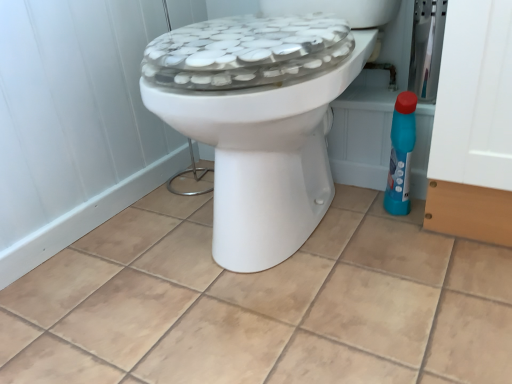
Locate an element on the screen. This screenshot has height=384, width=512. beige ceramic tile at center is located at coordinates (262, 304).

Locate an element on the screen. blue plastic bottle at right is located at coordinates (401, 154).

Locate an element on the screen. The image size is (512, 384). toilet that appears above the blue plastic bottle at right (from a real-world perspective) is located at coordinates (258, 121).

Consider the image. Is white glossy toilet at center looking in the opposite direction of blue plastic bottle at right?

No, white glossy toilet at center is not facing away from blue plastic bottle at right.

Considering the sizes of objects white glossy toilet at center and blue plastic bottle at right in the image provided, who is thinner, white glossy toilet at center or blue plastic bottle at right?

blue plastic bottle at right.

From the picture: Considering the relative sizes of white glossy toilet at center and blue plastic bottle at right in the image provided, is white glossy toilet at center smaller than blue plastic bottle at right?

No.

In the image, there is a beige ceramic tile at center. Identify the location of cleaning product above it (from the image's perspective). This screenshot has height=384, width=512. (401, 154).

Is beige ceramic tile at center not near blue plastic bottle at right?

They are positioned close to each other.

Is beige ceramic tile at center situated inside blue plastic bottle at right or outside?

beige ceramic tile at center is outside blue plastic bottle at right.

Does blue plastic bottle at right have a larger size compared to white glossy toilet at center?

No.

This screenshot has height=384, width=512. Identify the location of cleaning product located on the right of white glossy toilet at center. (401, 154).

From the image's perspective, is blue plastic bottle at right on top of white glossy toilet at center?

Incorrect, from the image's perspective, blue plastic bottle at right is lower than white glossy toilet at center.

Does beige ceramic tile at center lie behind white glossy toilet at center?

No.

Looking at this image, from the image's perspective, which one is positioned lower, beige ceramic tile at center or white glossy toilet at center?

beige ceramic tile at center, from the image's perspective.

In the image, is beige ceramic tile at center on the left side or the right side of white glossy toilet at center?

beige ceramic tile at center is to the left of white glossy toilet at center.

Where is `ceramic tile in front of the white glossy toilet at center`? The width and height of the screenshot is (512, 384). ceramic tile in front of the white glossy toilet at center is located at coordinates (262, 304).

Does point (356, 61) appear closer or farther from the camera than point (306, 355)?

Clearly, point (356, 61) is more distant from the camera than point (306, 355).

Is white glossy toilet at center not inside beige ceramic tile at center?

Absolutely, white glossy toilet at center is external to beige ceramic tile at center.

Can you confirm if white glossy toilet at center is smaller than beige ceramic tile at center?

Actually, white glossy toilet at center might be larger than beige ceramic tile at center.

From the image's perspective, which object appears higher, white glossy toilet at center or beige ceramic tile at center?

white glossy toilet at center, from the image's perspective.

Is blue plastic bottle at right bigger or smaller than beige ceramic tile at center?

Considering their sizes, blue plastic bottle at right takes up less space than beige ceramic tile at center.

Which of these two, blue plastic bottle at right or beige ceramic tile at center, stands shorter?

beige ceramic tile at center is shorter.

From the image's perspective, is blue plastic bottle at right located above or below beige ceramic tile at center?

blue plastic bottle at right is above beige ceramic tile at center.

Is blue plastic bottle at right not near beige ceramic tile at center?

They are positioned close to each other.

There is a blue plastic bottle at right. Identify the location of toilet above it (from a real-world perspective). (258, 121).

In the image, there is a beige ceramic tile at center. Where is `cleaning product above it (from the image's perspective)`? This screenshot has height=384, width=512. cleaning product above it (from the image's perspective) is located at coordinates (401, 154).

Based on their spatial positions, is blue plastic bottle at right or beige ceramic tile at center closer to white glossy toilet at center?

beige ceramic tile at center lies closer to white glossy toilet at center than the other object.

Which object lies nearer to the anchor point white glossy toilet at center, beige ceramic tile at center or blue plastic bottle at right?

beige ceramic tile at center is closer to white glossy toilet at center.

Looking at the image, which one is located further to blue plastic bottle at right, beige ceramic tile at center or white glossy toilet at center?

beige ceramic tile at center lies further to blue plastic bottle at right than the other object.

Estimate the real-world distances between objects in this image. Which object is closer to blue plastic bottle at right, white glossy toilet at center or beige ceramic tile at center?

Based on the image, white glossy toilet at center appears to be nearer to blue plastic bottle at right.

From the image, which object appears to be nearer to beige ceramic tile at center, white glossy toilet at center or blue plastic bottle at right?

The object closer to beige ceramic tile at center is white glossy toilet at center.

From the image, which object appears to be farther from beige ceramic tile at center, blue plastic bottle at right or white glossy toilet at center?

blue plastic bottle at right is positioned further to the anchor beige ceramic tile at center.

Identify the location of toilet positioned between beige ceramic tile at center and blue plastic bottle at right from near to far. (258, 121).